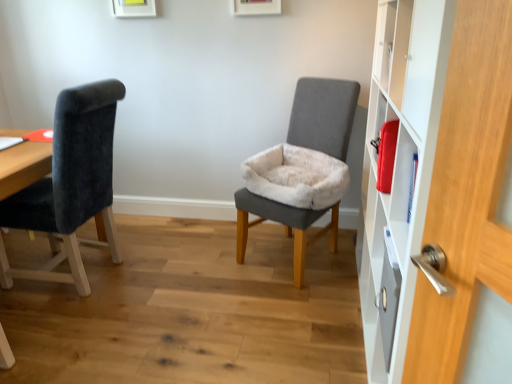
Question: Considering the relative positions of gray fabric chair at center, which is the 1th chair from right to left, and velvet black chair at left, marked as the first chair in a left-to-right arrangement, in the image provided, is gray fabric chair at center, which is the 1th chair from right to left, to the right of velvet black chair at left, marked as the first chair in a left-to-right arrangement, from the viewer's perspective?

Choices:
 (A) yes
 (B) no

Answer: (A)

Question: Can you confirm if gray fabric chair at center, which is the 2th chair from left to right, is positioned to the left of velvet black chair at left, which is the 2th chair in right-to-left order?

Choices:
 (A) yes
 (B) no

Answer: (B)

Question: Is gray fabric chair at center, which is the 1th chair from right to left, far from velvet black chair at left, marked as the first chair in a left-to-right arrangement?

Choices:
 (A) no
 (B) yes

Answer: (B)

Question: Is velvet black chair at left, which is the 2th chair in right-to-left order, at the back of gray fabric chair at center, which is the 1th chair from right to left?

Choices:
 (A) no
 (B) yes

Answer: (A)

Question: Is gray fabric chair at center, which is the 2th chair from left to right, wider than velvet black chair at left, marked as the first chair in a left-to-right arrangement?

Choices:
 (A) yes
 (B) no

Answer: (B)

Question: Looking at the image, does velvet black chair at left, marked as the first chair in a left-to-right arrangement, seem bigger or smaller compared to gray fabric chair at center, which is the 1th chair from right to left?

Choices:
 (A) small
 (B) big

Answer: (A)

Question: From a real-world perspective, relative to gray fabric chair at center, which is the 1th chair from right to left, is velvet black chair at left, which is the 2th chair in right-to-left order, vertically above or below?

Choices:
 (A) above
 (B) below

Answer: (A)

Question: From the image's perspective, is velvet black chair at left, which is the 2th chair in right-to-left order, located above or below gray fabric chair at center, which is the 1th chair from right to left?

Choices:
 (A) above
 (B) below

Answer: (B)

Question: Considering the positions of velvet black chair at left, marked as the first chair in a left-to-right arrangement, and gray fabric chair at center, which is the 2th chair from left to right, in the image, is velvet black chair at left, marked as the first chair in a left-to-right arrangement, wider or thinner than gray fabric chair at center, which is the 2th chair from left to right,?

Choices:
 (A) wide
 (B) thin

Answer: (A)

Question: Which is correct: velvet black chair at left, which is the 2th chair in right-to-left order, is inside white matte cabinet at right, or outside of it?

Choices:
 (A) inside
 (B) outside

Answer: (B)

Question: From a real-world perspective, relative to white matte cabinet at right, is velvet black chair at left, which is the 2th chair in right-to-left order, vertically above or below?

Choices:
 (A) below
 (B) above

Answer: (A)

Question: Considering the positions of velvet black chair at left, marked as the first chair in a left-to-right arrangement, and white matte cabinet at right in the image, is velvet black chair at left, marked as the first chair in a left-to-right arrangement, wider or thinner than white matte cabinet at right?

Choices:
 (A) wide
 (B) thin

Answer: (A)

Question: Considering the positions of velvet black chair at left, marked as the first chair in a left-to-right arrangement, and white matte cabinet at right in the image, is velvet black chair at left, marked as the first chair in a left-to-right arrangement, taller or shorter than white matte cabinet at right?

Choices:
 (A) short
 (B) tall

Answer: (A)

Question: Choose the correct answer: Is white matte cabinet at right inside gray fabric chair at center, which is the 2th chair from left to right, or outside it?

Choices:
 (A) inside
 (B) outside

Answer: (B)

Question: Is point (458, 165) closer or farther from the camera than point (343, 102)?

Choices:
 (A) farther
 (B) closer

Answer: (B)